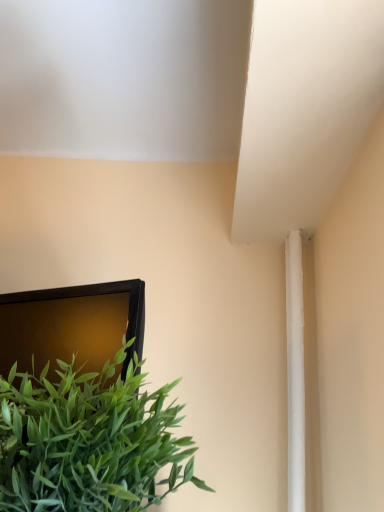
Question: Should I look upward or downward to see green leafy plant at lower left?

Choices:
 (A) down
 (B) up

Answer: (A)